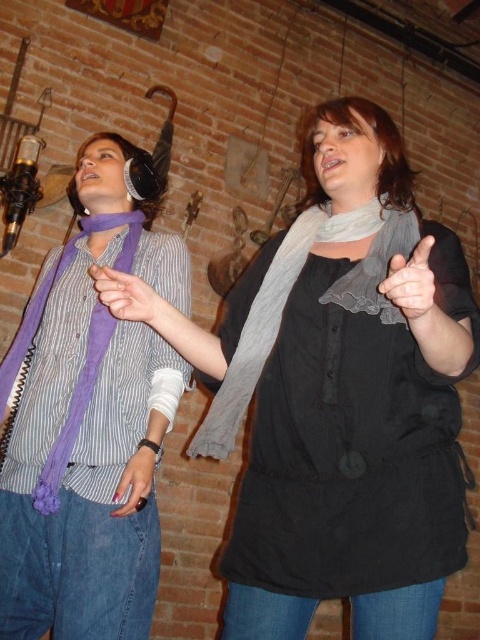
You are organizing a costume party and need to choose between two purple scarves for your outfit. The purple soft scarf at left and the purple fabric scarf at left are both available. Which one should you pick if you want the larger option?

The purple soft scarf at left is larger in size compared to the purple fabric scarf at left, so you should choose the purple soft scarf at left for the larger option.

You are an interior designer assessing the wall decorations in this space. You notice the gray textured scarf at center and the purple silky scarf at left. Which scarf is closer to the viewer?

The gray textured scarf at center is closer to the viewer as it is positioned in front of the purple silky scarf at left.

You are an interior designer planning to hang a picture frame between the purple soft scarf at left and the purple scarf at center. Based on their positions, which object is higher up and should the frame be placed above or below it to maintain visual balance?

The purple soft scarf at left is much taller than the purple scarf at center. To maintain visual balance, the picture frame should be placed above the purple scarf at center so it aligns with the height of the taller scarf.